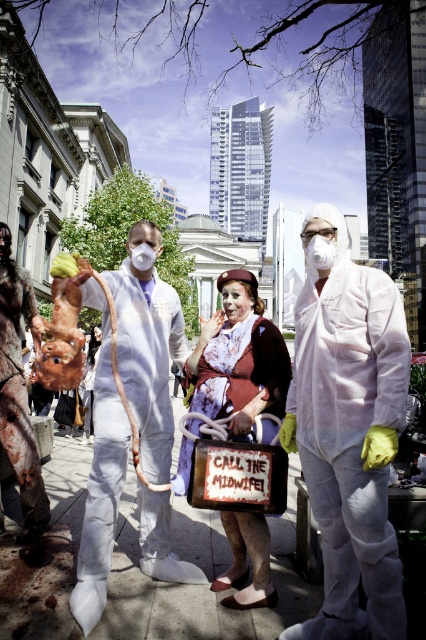
You are a photographer trying to capture the matte brown dress at center in a cityscape with three people in white protective suits. Where should you position your camera to ensure the dress is centered in your shot?

To center the matte brown dress at center in your shot, position your camera directly facing the coordinates point at (238, 358) where the dress is located.

You are organizing a costume party and need to ensure all costumes fit through a standard doorway that is 80 cm wide. Given the descriptions, will the matte brown dress at center and the rusty metal pig at left both fit through the doorway?

The matte brown dress at center is wider than the rusty metal pig at left. Since the doorway is 80 cm wide, the rusty metal pig at left may fit, but the matte brown dress at center might not due to its larger width.